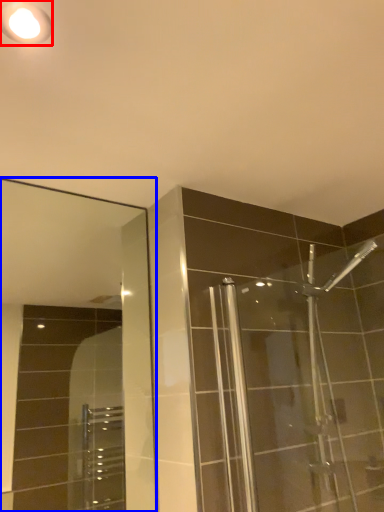
Question: Among these objects, which one is farthest to the camera, light fixture (highlighted by a red box) or mirror (highlighted by a blue box)?

Choices:
 (A) light fixture
 (B) mirror

Answer: (B)